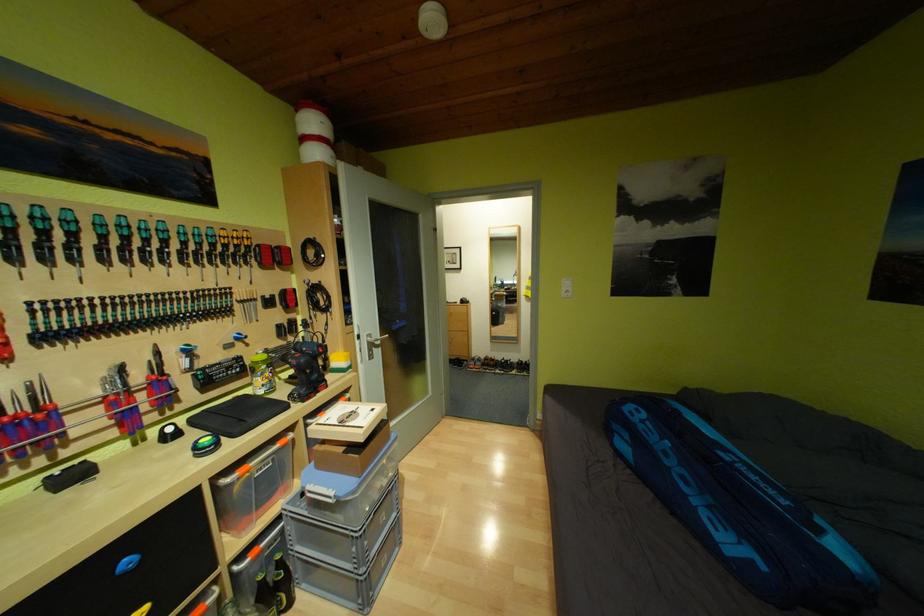
The width and height of the screenshot is (924, 616). What do you see at coordinates (128, 564) in the screenshot?
I see `the blue drawer handle` at bounding box center [128, 564].